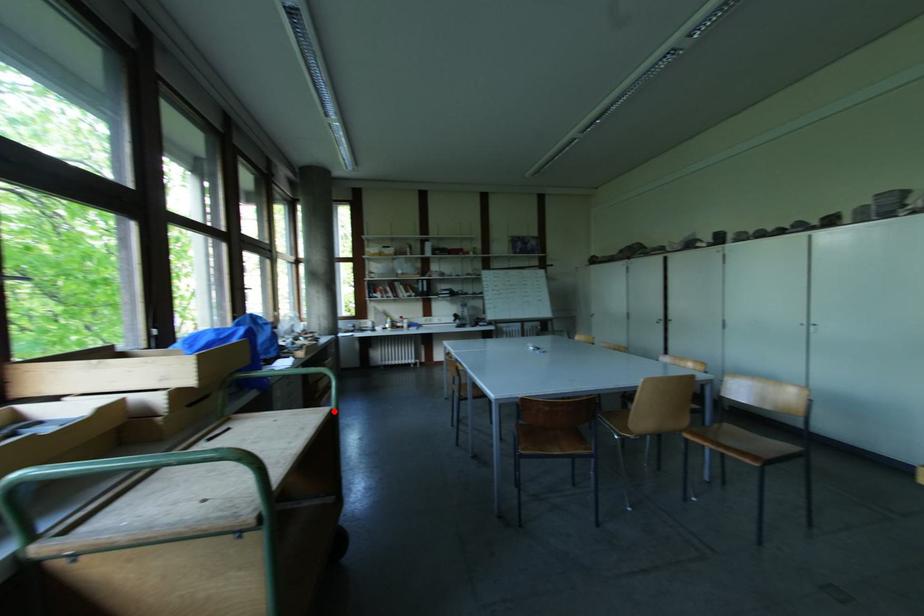
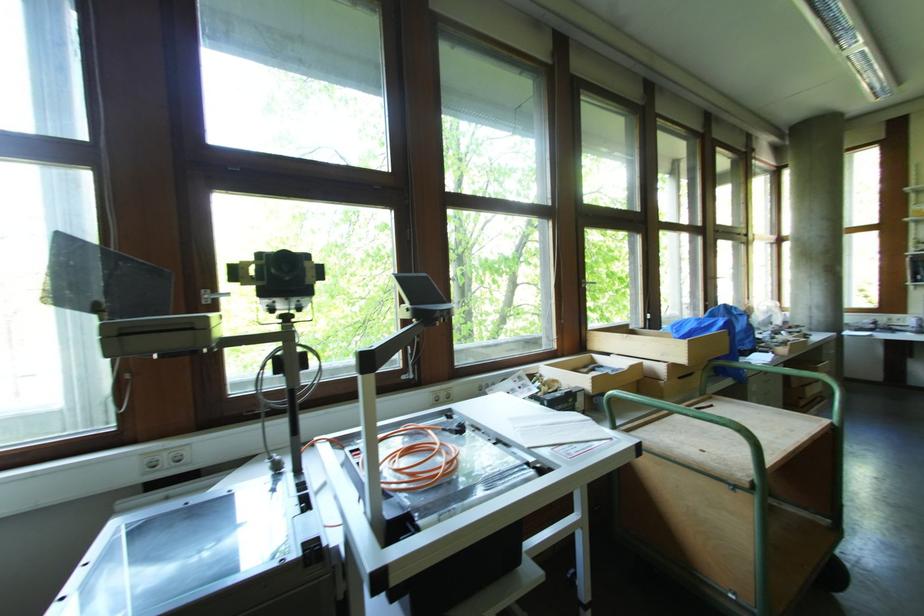
Find the pixel in the second image that matches the highlighted location in the first image.

(834, 426)